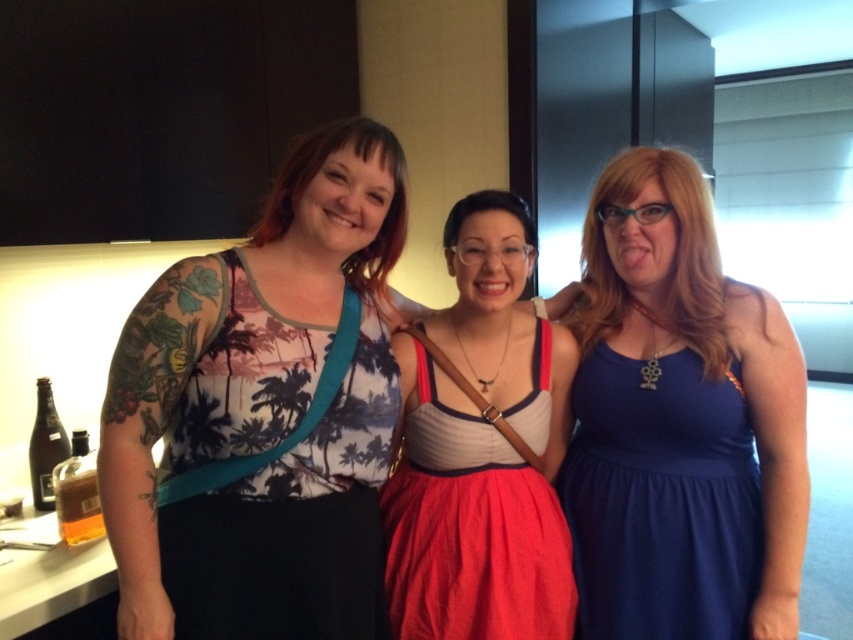
Question: Is printed fabric top at center smaller than navy blue fabric dress at right?

Choices:
 (A) no
 (B) yes

Answer: (A)

Question: Among these points, which one is farthest from the camera?

Choices:
 (A) (415, 486)
 (B) (338, 340)
 (C) (643, 388)
 (D) (199, 355)

Answer: (A)

Question: From the image, what is the correct spatial relationship of printed fabric dress at center in relation to navy blue fabric dress at right?

Choices:
 (A) left
 (B) right

Answer: (A)

Question: Considering the real-world distances, which object is farthest from the printed fabric top at center?

Choices:
 (A) printed fabric dress at center
 (B) matte red dress at center
 (C) navy blue fabric dress at right

Answer: (C)

Question: Estimate the real-world distances between objects in this image. Which object is farther from the printed fabric top at center?

Choices:
 (A) matte red dress at center
 (B) printed fabric dress at center

Answer: (A)

Question: Is printed fabric top at center further to camera compared to navy blue fabric dress at right?

Choices:
 (A) yes
 (B) no

Answer: (B)